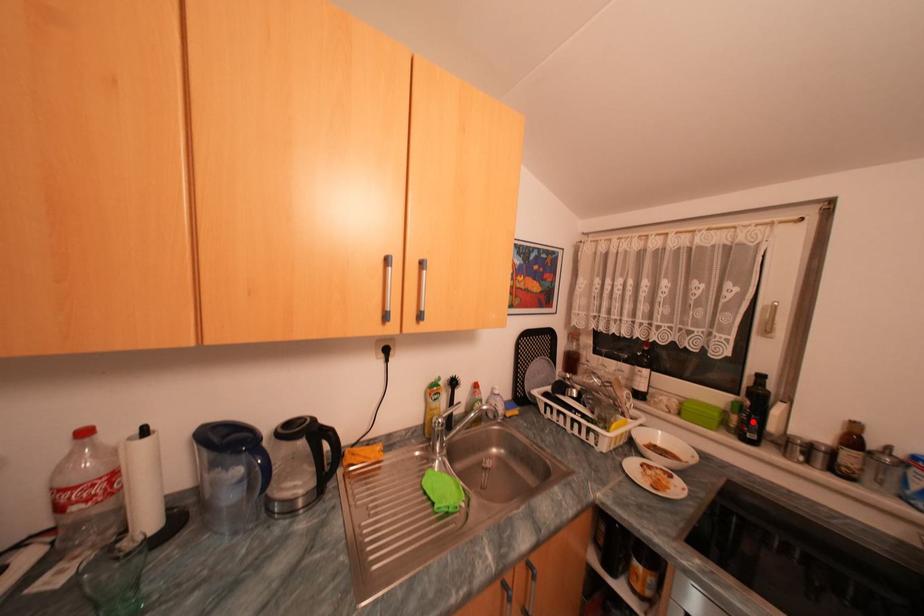
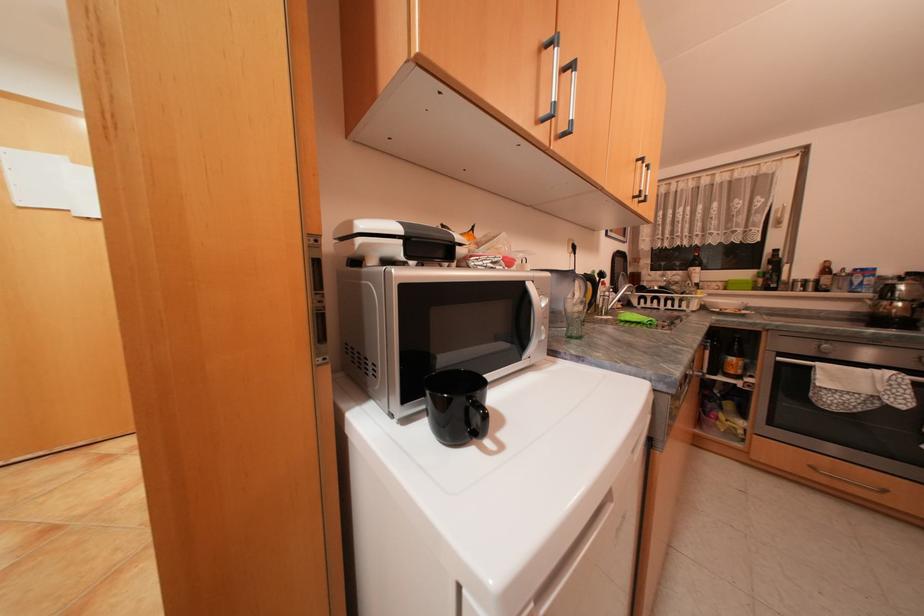
The point at the highlighted location is marked in the first image. Where is the corresponding point in the second image?

(776, 280)